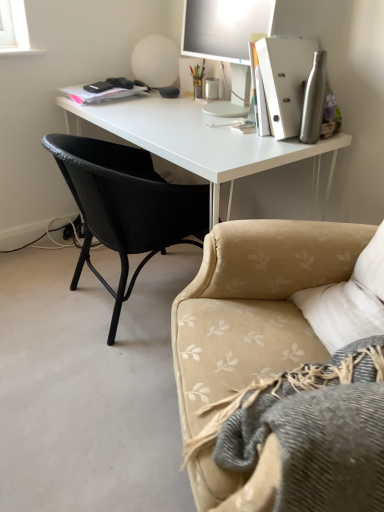
Locate an element on the screen. This screenshot has height=512, width=384. free point to the left of silver metallic water bottle at right is located at coordinates (254, 143).